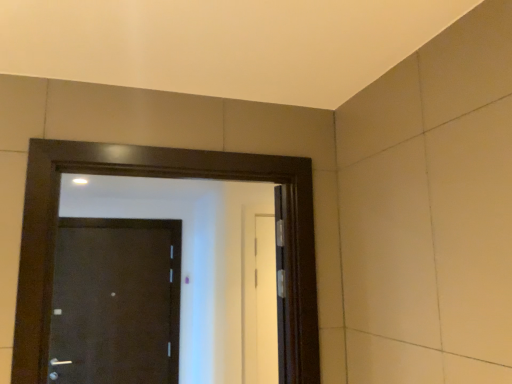
Describe the element at coordinates (116, 301) in the screenshot. I see `matte black door at center, the 2th door in the right-to-left sequence` at that location.

Image resolution: width=512 pixels, height=384 pixels. Identify the location of matte black door at center, the second door viewed from the front. (116, 301).

The image size is (512, 384). Find the location of `black glossy door at center, which ranks as the 2th door in left-to-right order`. black glossy door at center, which ranks as the 2th door in left-to-right order is located at coordinates (156, 176).

This screenshot has width=512, height=384. Describe the element at coordinates (156, 176) in the screenshot. I see `black glossy door at center, which is counted as the 1th door, starting from the right` at that location.

What is the approximate width of black glossy door at center, which appears as the 2th door when viewed from the back?

black glossy door at center, which appears as the 2th door when viewed from the back, is 6.41 inches wide.

Find the location of a particular element. Image resolution: width=512 pixels, height=384 pixels. matte black door at center, placed as the 1th door when sorted from back to front is located at coordinates (116, 301).

Which object is positioned more to the right, matte black door at center, the second door viewed from the front, or black glossy door at center, placed as the first door when sorted from front to back?

black glossy door at center, placed as the first door when sorted from front to back, is more to the right.

Which is in front, matte black door at center, the second door viewed from the front, or black glossy door at center, which is counted as the 1th door, starting from the right?

Positioned in front is black glossy door at center, which is counted as the 1th door, starting from the right.

Which point is more forward, (72,340) or (30,309)?

The point (30,309) is closer to the camera.

From the image's perspective, is matte black door at center, placed as the first door when sorted from left to right, above or below black glossy door at center, which is counted as the 1th door, starting from the right?

From the image's perspective, matte black door at center, placed as the first door when sorted from left to right, appears below black glossy door at center, which is counted as the 1th door, starting from the right.

From a real-world perspective, who is located higher, matte black door at center, the 2th door in the right-to-left sequence, or black glossy door at center, which appears as the 2th door when viewed from the back?

black glossy door at center, which appears as the 2th door when viewed from the back, is physically above.

Which object is thinner, matte black door at center, the second door viewed from the front, or black glossy door at center, placed as the first door when sorted from front to back?

Thinner between the two is matte black door at center, the second door viewed from the front.

Considering the sizes of matte black door at center, the 2th door in the right-to-left sequence, and black glossy door at center, which ranks as the 2th door in left-to-right order, in the image, is matte black door at center, the 2th door in the right-to-left sequence, taller or shorter than black glossy door at center, which ranks as the 2th door in left-to-right order,?

matte black door at center, the 2th door in the right-to-left sequence, is taller than black glossy door at center, which ranks as the 2th door in left-to-right order.

Looking at this image, can you confirm if matte black door at center, placed as the first door when sorted from left to right, is smaller than black glossy door at center, which is counted as the 1th door, starting from the right?

Yes.

Which is correct: matte black door at center, placed as the 1th door when sorted from back to front, is inside black glossy door at center, which ranks as the 2th door in left-to-right order, or outside of it?

matte black door at center, placed as the 1th door when sorted from back to front, is located beyond the bounds of black glossy door at center, which ranks as the 2th door in left-to-right order.

Are matte black door at center, placed as the first door when sorted from left to right, and black glossy door at center, which appears as the 2th door when viewed from the back, far apart?

Yes.

Is matte black door at center, placed as the first door when sorted from left to right, facing away from black glossy door at center, placed as the first door when sorted from front to back?

matte black door at center, placed as the first door when sorted from left to right, is not turned away from black glossy door at center, placed as the first door when sorted from front to back.

How far apart are matte black door at center, placed as the 1th door when sorted from back to front, and black glossy door at center, placed as the first door when sorted from front to back?

2.26 meters.

The height and width of the screenshot is (384, 512). I want to click on door located underneath the black glossy door at center, which is counted as the 1th door, starting from the right (from a real-world perspective), so click(116, 301).

Which is more to the right, black glossy door at center, which ranks as the 2th door in left-to-right order, or matte black door at center, placed as the 1th door when sorted from back to front?

black glossy door at center, which ranks as the 2th door in left-to-right order, is more to the right.

Considering the positions of objects black glossy door at center, which appears as the 2th door when viewed from the back, and matte black door at center, the 2th door in the right-to-left sequence, in the image provided, who is behind, black glossy door at center, which appears as the 2th door when viewed from the back, or matte black door at center, the 2th door in the right-to-left sequence,?

matte black door at center, the 2th door in the right-to-left sequence, is more distant.

Is point (25, 251) positioned after point (90, 324)?

No, it is not.

From the image's perspective, which is below, black glossy door at center, placed as the first door when sorted from front to back, or matte black door at center, the 2th door in the right-to-left sequence?

matte black door at center, the 2th door in the right-to-left sequence, from the image's perspective.

Consider the image. From a real-world perspective, is black glossy door at center, placed as the first door when sorted from front to back, on matte black door at center, placed as the 1th door when sorted from back to front?

Indeed, from a real-world perspective, black glossy door at center, placed as the first door when sorted from front to back, stands above matte black door at center, placed as the 1th door when sorted from back to front.

Which object is wider, black glossy door at center, placed as the first door when sorted from front to back, or matte black door at center, placed as the 1th door when sorted from back to front?

black glossy door at center, placed as the first door when sorted from front to back, is wider.

Between black glossy door at center, which appears as the 2th door when viewed from the back, and matte black door at center, the second door viewed from the front, which one has more height?

Standing taller between the two is matte black door at center, the second door viewed from the front.

Between black glossy door at center, which ranks as the 2th door in left-to-right order, and matte black door at center, the 2th door in the right-to-left sequence, which one has larger size?

With larger size is black glossy door at center, which ranks as the 2th door in left-to-right order.

Is black glossy door at center, which is counted as the 1th door, starting from the right, inside the boundaries of matte black door at center, placed as the first door when sorted from left to right, or outside?

black glossy door at center, which is counted as the 1th door, starting from the right, is not inside matte black door at center, placed as the first door when sorted from left to right, it's outside.

From the picture: Is black glossy door at center, placed as the first door when sorted from front to back, not near matte black door at center, placed as the first door when sorted from left to right?

Yes, black glossy door at center, placed as the first door when sorted from front to back, and matte black door at center, placed as the first door when sorted from left to right, are quite far apart.

Is black glossy door at center, which appears as the 2th door when viewed from the back, facing away from matte black door at center, the second door viewed from the front?

Correct, black glossy door at center, which appears as the 2th door when viewed from the back, is looking away from matte black door at center, the second door viewed from the front.

Can you tell me how much black glossy door at center, which ranks as the 2th door in left-to-right order, and matte black door at center, the 2th door in the right-to-left sequence, differ in facing direction?

2.18 degrees.

Could you measure the distance between black glossy door at center, which appears as the 2th door when viewed from the back, and matte black door at center, placed as the 1th door when sorted from back to front?

black glossy door at center, which appears as the 2th door when viewed from the back, is 2.26 meters from matte black door at center, placed as the 1th door when sorted from back to front.

Identify the location of door that appears below the black glossy door at center, which appears as the 2th door when viewed from the back (from the image's perspective). (116, 301).

The image size is (512, 384). Identify the location of door below the black glossy door at center, which is counted as the 1th door, starting from the right (from a real-world perspective). (116, 301).

I want to click on door located in front of the matte black door at center, the second door viewed from the front, so click(156, 176).